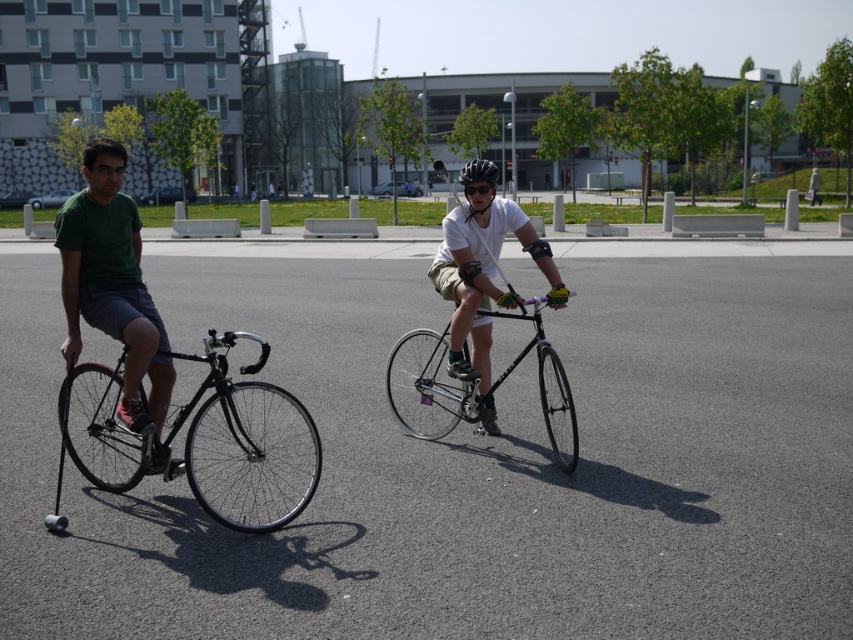
Who is positioned more to the left, green matte shirt at left or matte black bicycle at center?

green matte shirt at left

Between green matte shirt at left and matte black bicycle at center, which one appears on the right side from the viewer's perspective?

Positioned to the right is matte black bicycle at center.

Does point (129, 232) come behind point (457, 292)?

No, (129, 232) is closer to viewer.

Find the location of a particular element. This screenshot has height=640, width=853. green matte shirt at left is located at coordinates (113, 289).

Does shiny black bicycle at left have a lesser width compared to green matte shirt at left?

In fact, shiny black bicycle at left might be wider than green matte shirt at left.

Is point (93, 376) positioned after point (105, 161)?

Yes, it is behind point (105, 161).

Does point (207, 460) come farther from viewer compared to point (126, 244)?

Yes, it is.

Image resolution: width=853 pixels, height=640 pixels. What are the coordinates of `shiny black bicycle at left` in the screenshot? It's located at (244, 442).

Between green matte shirt at left and black matte helmet at upper center, which one has less height?

With less height is green matte shirt at left.

Does green matte shirt at left lie in front of black matte helmet at upper center?

That is True.

Between point (152, 358) and point (489, 166), which one is positioned behind?

The point (489, 166) is more distant.

This screenshot has height=640, width=853. What are the coordinates of `green matte shirt at left` in the screenshot? It's located at (113, 289).